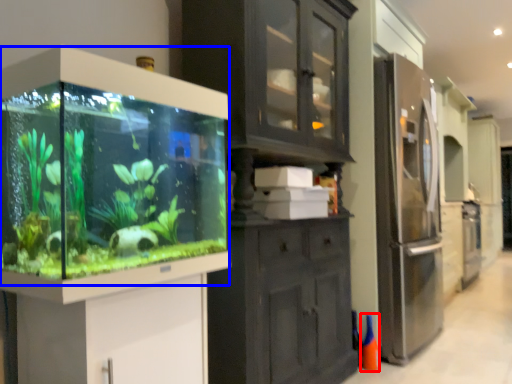
Question: Which object appears farthest to the camera in this image, cone (highlighted by a red box) or glass box (highlighted by a blue box)?

Choices:
 (A) cone
 (B) glass box

Answer: (A)